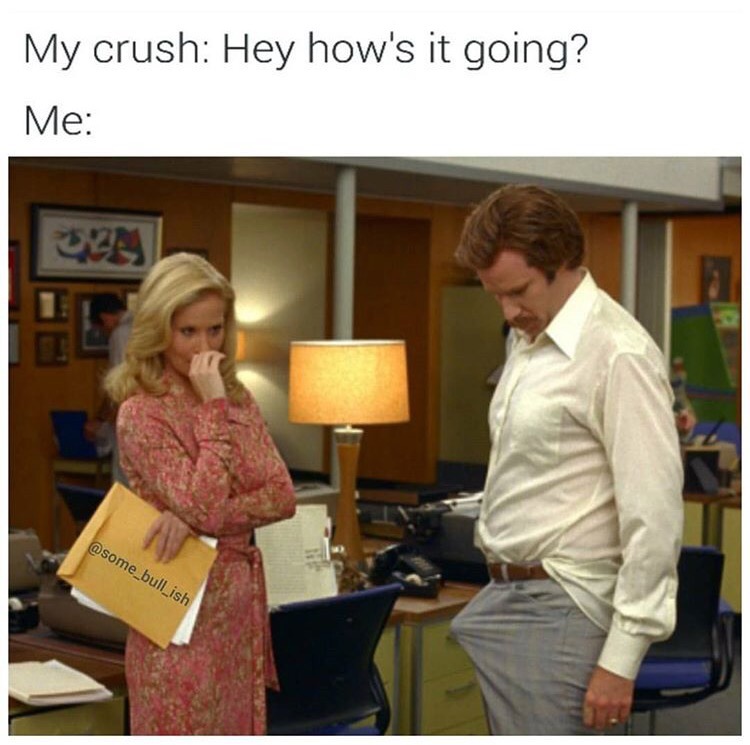
The width and height of the screenshot is (750, 745). Find the location of `blue chair`. blue chair is located at coordinates (345, 641).